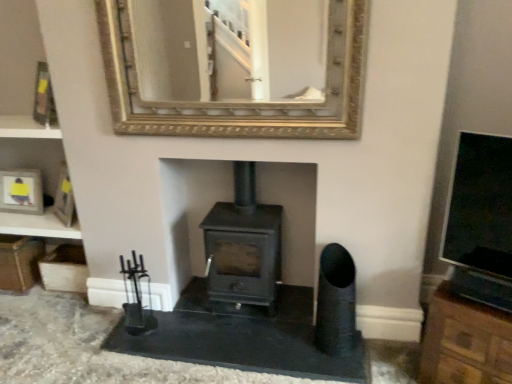
Question: From the image's perspective, is gold-framed mirror at upper center located beneath black matte wood burning stove at center?

Choices:
 (A) yes
 (B) no

Answer: (B)

Question: Is gold-framed mirror at upper center completely or partially outside of black matte wood burning stove at center?

Choices:
 (A) no
 (B) yes

Answer: (B)

Question: Is gold-framed mirror at upper center turned away from black matte wood burning stove at center?

Choices:
 (A) no
 (B) yes

Answer: (A)

Question: Is there a large distance between gold-framed mirror at upper center and black matte wood burning stove at center?

Choices:
 (A) no
 (B) yes

Answer: (A)

Question: From the image's perspective, is gold-framed mirror at upper center located above black matte wood burning stove at center?

Choices:
 (A) no
 (B) yes

Answer: (B)

Question: Considering the relative sizes of gold-framed mirror at upper center and black matte wood burning stove at center in the image provided, is gold-framed mirror at upper center wider than black matte wood burning stove at center?

Choices:
 (A) yes
 (B) no

Answer: (B)

Question: Is metallic gold picture frame at upper left thinner than black matte wood burning stove at center?

Choices:
 (A) yes
 (B) no

Answer: (A)

Question: Considering the relative sizes of metallic gold picture frame at upper left and black matte wood burning stove at center in the image provided, is metallic gold picture frame at upper left shorter than black matte wood burning stove at center?

Choices:
 (A) no
 (B) yes

Answer: (B)

Question: Is metallic gold picture frame at upper left not inside black matte wood burning stove at center?

Choices:
 (A) no
 (B) yes

Answer: (B)

Question: Is metallic gold picture frame at upper left looking in the opposite direction of black matte wood burning stove at center?

Choices:
 (A) no
 (B) yes

Answer: (A)

Question: Is black matte wood burning stove at center a part of metallic gold picture frame at upper left?

Choices:
 (A) yes
 (B) no

Answer: (B)

Question: Does metallic gold picture frame at upper left turn towards black matte wood burning stove at center?

Choices:
 (A) no
 (B) yes

Answer: (A)

Question: Is black matte wood burning stove at center positioned in front of metallic gold picture frame at upper left?

Choices:
 (A) no
 (B) yes

Answer: (B)